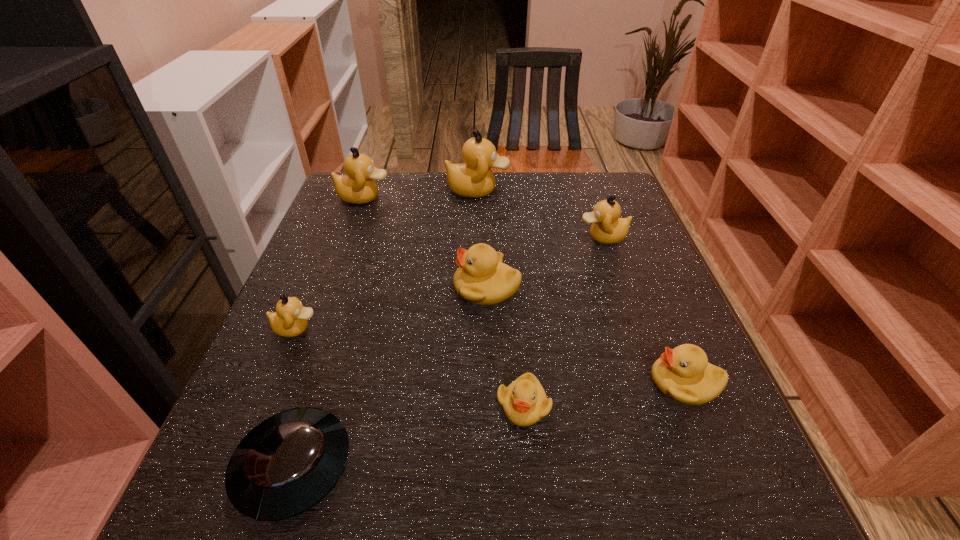
Where is `object that is at the near left corner`? Image resolution: width=960 pixels, height=540 pixels. object that is at the near left corner is located at coordinates (288, 463).

Find the location of a particular element. blank space at the far edge is located at coordinates pos(516,175).

I want to click on vacant space at the near edge of the desktop, so click(x=579, y=504).

Identify the location of vacant area at the left edge of the desktop. (334, 269).

Where is `free space at the right edge`? free space at the right edge is located at coordinates [x=610, y=299].

Where is `blank space at the far left corner of the desktop`? blank space at the far left corner of the desktop is located at coordinates (375, 199).

Find the location of `vacant space at the far right corner`. vacant space at the far right corner is located at coordinates (602, 198).

Where is `empty space that is in between the fourth farthest duckling and the nearest tan duckling`? Image resolution: width=960 pixels, height=540 pixels. empty space that is in between the fourth farthest duckling and the nearest tan duckling is located at coordinates (392, 308).

You are a GUI agent. You are given a task and a screenshot of the screen. Output one action in this format:
    pyautogui.click(x=<x>, y=<y>)
    Task: Click on the vacant area that lies between the fourth farthest duckling and the saucer
    This screenshot has height=540, width=960.
    Given the screenshot: What is the action you would take?
    pyautogui.click(x=390, y=377)

The width and height of the screenshot is (960, 540). What are the coordinates of `blank region between the second smallest yellow duckling and the biggest tan duckling` in the screenshot? It's located at (581, 286).